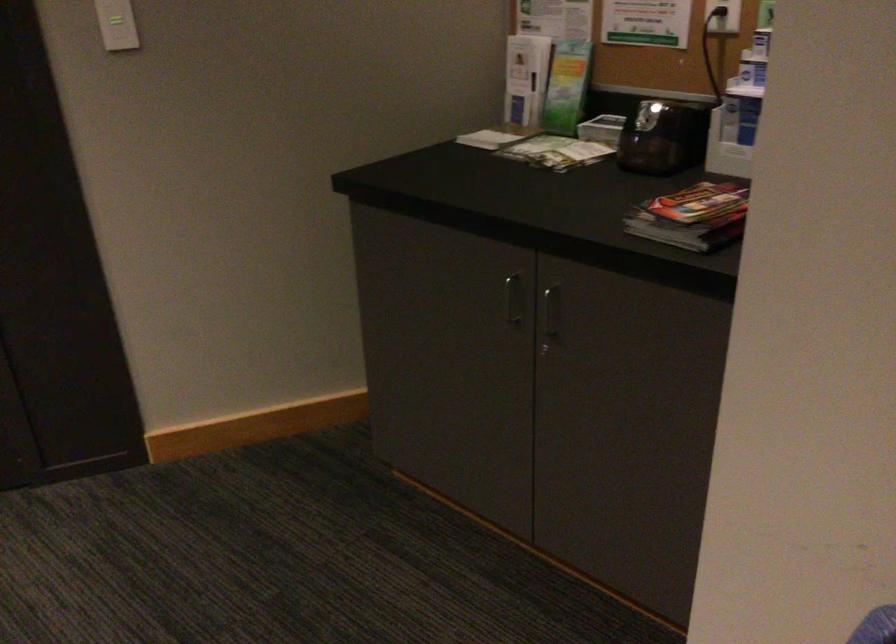
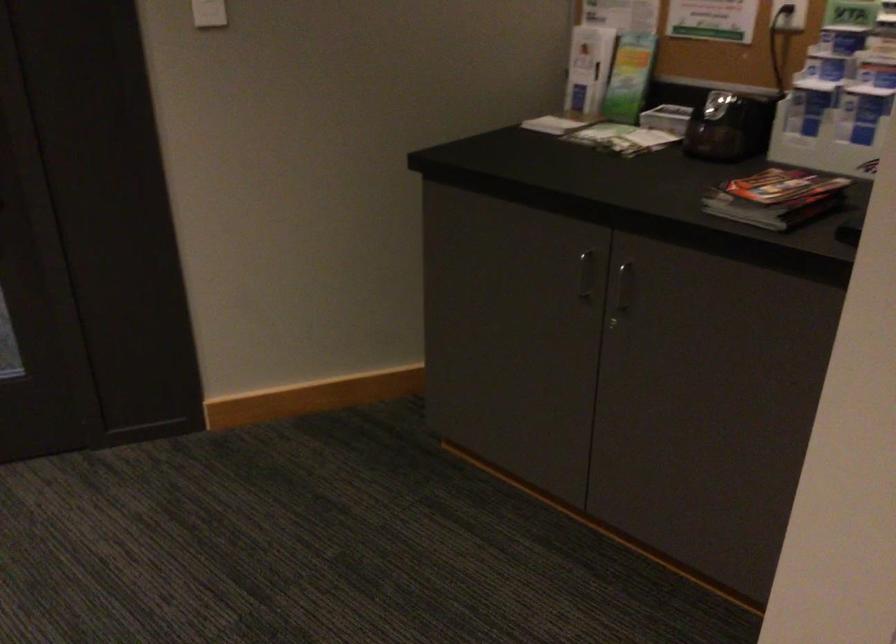
In the second image, find the point that corresponds to [549,317] in the first image.

(622, 292)